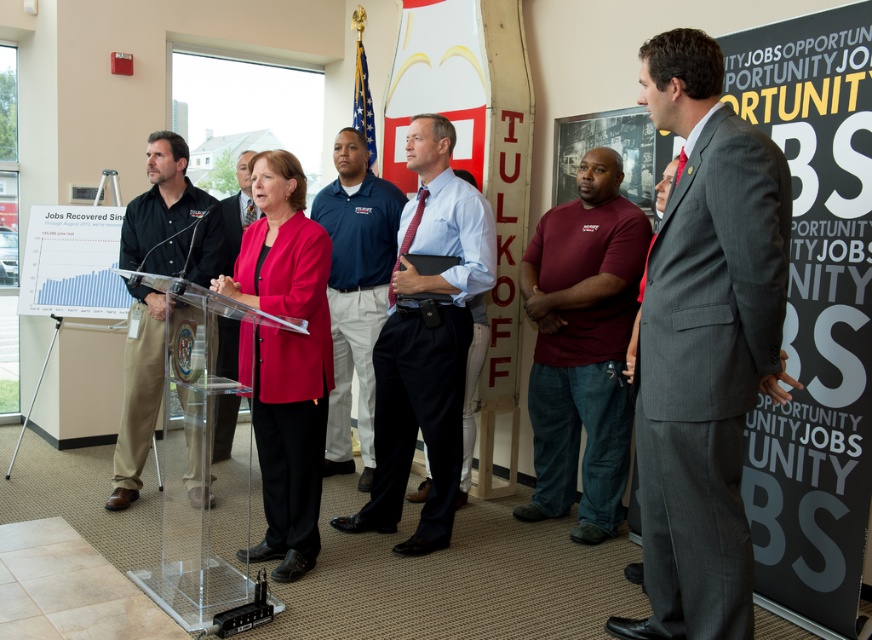
Does matte red blazer at center appear on the left side of transparent acrylic podium at center?

No, matte red blazer at center is not to the left of transparent acrylic podium at center.

Which is below, matte red blazer at center or transparent acrylic podium at center?

transparent acrylic podium at center

This screenshot has height=640, width=872. What do you see at coordinates (285, 358) in the screenshot?
I see `matte red blazer at center` at bounding box center [285, 358].

Locate an element on the screen. The width and height of the screenshot is (872, 640). matte red blazer at center is located at coordinates (285, 358).

Which is above, maroon t-shirt at center or black shirt at left?

black shirt at left is higher up.

Can you confirm if maroon t-shirt at center is positioned below black shirt at left?

Indeed, maroon t-shirt at center is positioned under black shirt at left.

This screenshot has height=640, width=872. What do you see at coordinates (582, 346) in the screenshot?
I see `maroon t-shirt at center` at bounding box center [582, 346].

Where is `maroon t-shirt at center`? This screenshot has width=872, height=640. maroon t-shirt at center is located at coordinates (582, 346).

Does gray pinstripe suit at center have a lesser height compared to black shirt at left?

No, gray pinstripe suit at center is not shorter than black shirt at left.

The image size is (872, 640). What do you see at coordinates (704, 344) in the screenshot?
I see `gray pinstripe suit at center` at bounding box center [704, 344].

You are a GUI agent. You are given a task and a screenshot of the screen. Output one action in this format:
    pyautogui.click(x=<x>, y=<y>)
    Task: Click on the gray pinstripe suit at center
    The height and width of the screenshot is (640, 872).
    Given the screenshot: What is the action you would take?
    pyautogui.click(x=704, y=344)